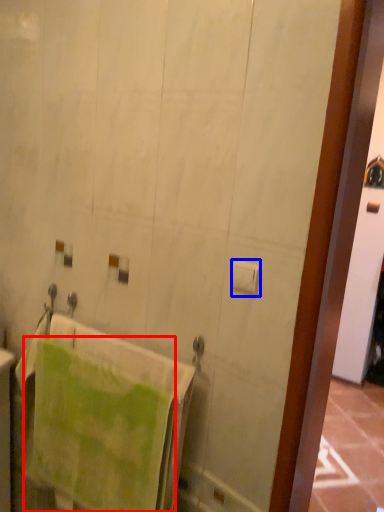
Question: Among these objects, which one is nearest to the camera, towel (highlighted by a red box) or toilet paper (highlighted by a blue box)?

Choices:
 (A) towel
 (B) toilet paper

Answer: (B)